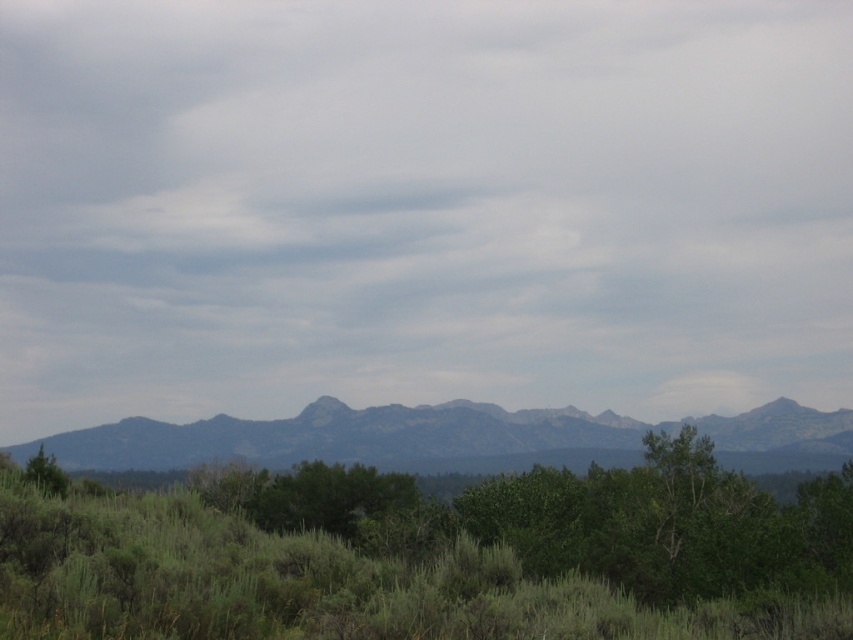
Question: Which of the following is the farthest from the observer?

Choices:
 (A) (55, 461)
 (B) (759, 384)

Answer: (B)

Question: Is green leafy tree at center in front of gray rocky mountains at center?

Choices:
 (A) yes
 (B) no

Answer: (A)

Question: Where is gray rocky mountains at center located in relation to green matte tree at lower left in the image?

Choices:
 (A) below
 (B) above

Answer: (A)

Question: Is gray rocky mountains at center smaller than green matte tree at lower left?

Choices:
 (A) no
 (B) yes

Answer: (A)

Question: Which object is the farthest from the gray matte cloud at upper center?

Choices:
 (A) gray rocky mountains at center
 (B) green matte tree at lower left
 (C) green leafy tree at center

Answer: (C)

Question: Which is farther from the green matte tree at lower left?

Choices:
 (A) gray rocky mountains at center
 (B) gray matte cloud at upper center
 (C) green leafy tree at center

Answer: (B)